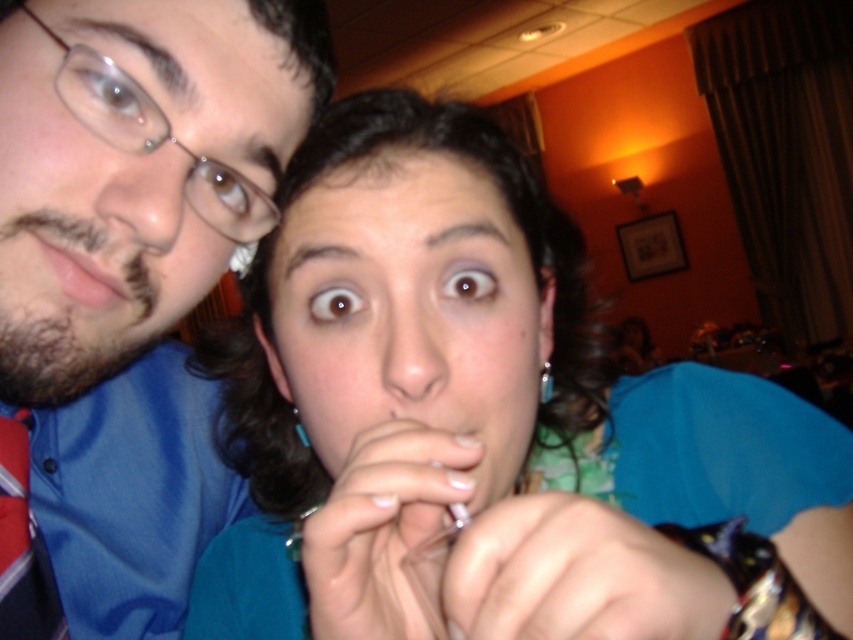
Is blue fabric shirt at center positioned behind clear plastic glasses at upper left?

No, it is in front of clear plastic glasses at upper left.

In the scene shown: Is blue fabric shirt at center to the left of clear plastic glasses at upper left from the viewer's perspective?

In fact, blue fabric shirt at center is to the right of clear plastic glasses at upper left.

The width and height of the screenshot is (853, 640). What do you see at coordinates (491, 420) in the screenshot?
I see `blue fabric shirt at center` at bounding box center [491, 420].

In order to click on blue fabric shirt at center in this screenshot , I will do `click(491, 420)`.

Based on the photo, is blue fabric shirt at center wider than matte pink lips at left?

Indeed, blue fabric shirt at center has a greater width compared to matte pink lips at left.

Is blue fabric shirt at center further to camera compared to matte pink lips at left?

That is False.

Locate an element on the screen. This screenshot has width=853, height=640. blue fabric shirt at center is located at coordinates 491,420.

Between blue fabric shirt at center and blue satin shirt at upper left, which one is positioned higher?

blue satin shirt at upper left is above.

Does blue fabric shirt at center lie in front of blue satin shirt at upper left?

That is True.

Is point (389, 572) positioned after point (184, 132)?

That is False.

This screenshot has width=853, height=640. Find the location of `blue fabric shirt at center`. blue fabric shirt at center is located at coordinates (491, 420).